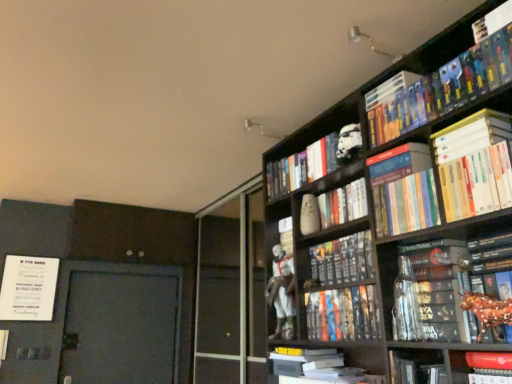
Where is `free space above white matte book at upper right, which is the third book from top to bottom (from a real-world perspective)`? free space above white matte book at upper right, which is the third book from top to bottom (from a real-world perspective) is located at coordinates (463, 119).